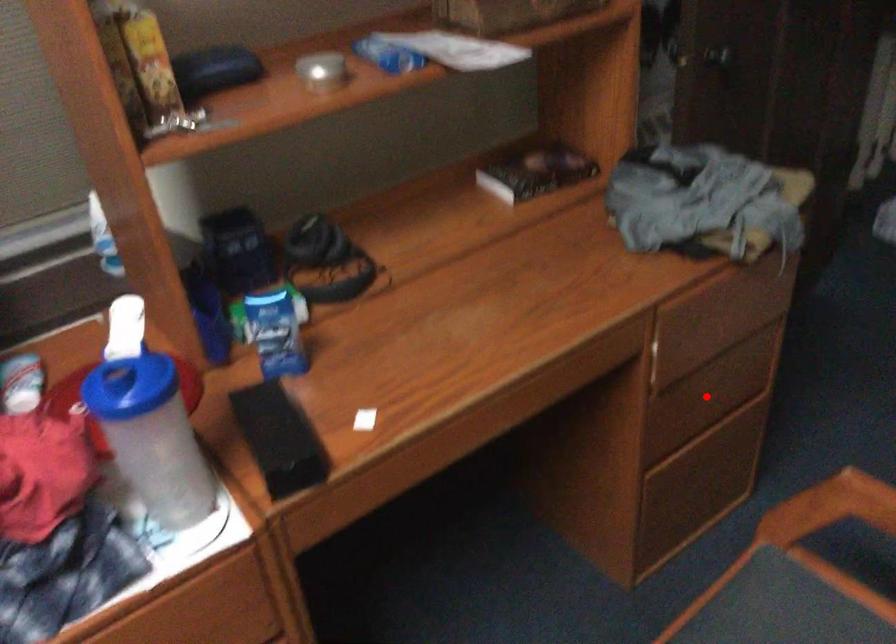
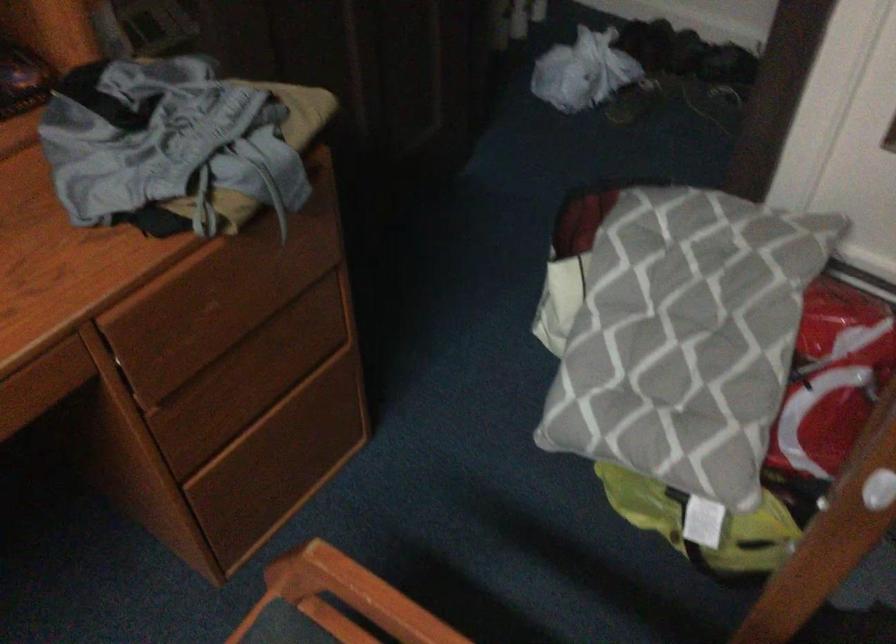
Question: A red point is marked in image1. In image2, is the corresponding 3D point closer to the camera or farther? Reply with the corresponding letter.

Choices:
 (A) The corresponding 3D point is closer.
 (B) The corresponding 3D point is farther.

Answer: (A)